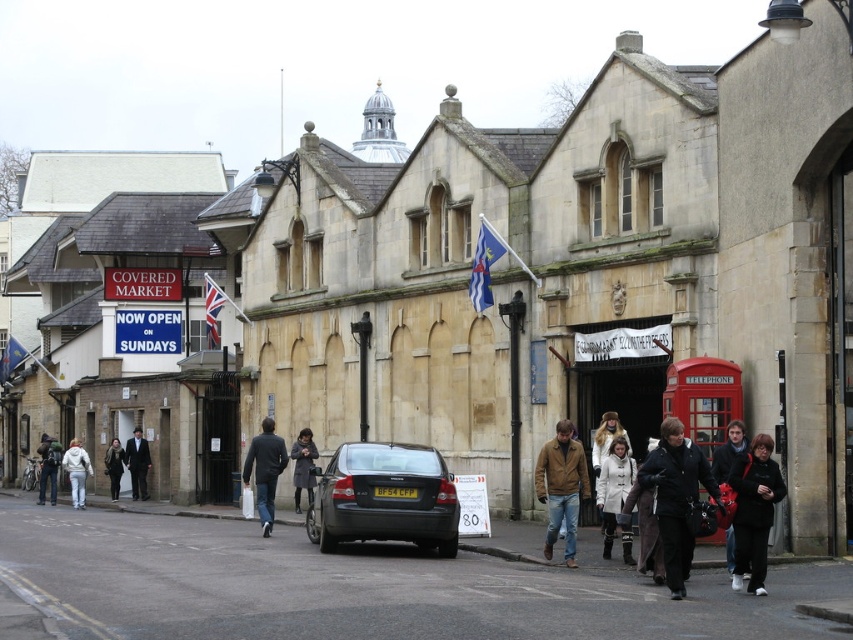
Question: Considering the relative positions of white wool coat at center and white fleece jacket at center in the image provided, where is white wool coat at center located with respect to white fleece jacket at center?

Choices:
 (A) above
 (B) below

Answer: (A)

Question: Does black fabric jacket at lower right appear under dark brown leather coat at center?

Choices:
 (A) no
 (B) yes

Answer: (A)

Question: Which of the following is the farthest from the observer?

Choices:
 (A) (728, 422)
 (B) (424, 541)
 (C) (129, 448)
 (D) (74, 445)

Answer: (C)

Question: Estimate the real-world distances between objects in this image. Which object is closer to the dark brown leather jacket at lower left?

Choices:
 (A) white fleece jacket at center
 (B) dark brown leather coat at center
 (C) dark blue jacket at center
 (D) brown leather jacket at center

Answer: (A)

Question: Which point is closer to the camera taking this photo?

Choices:
 (A) (115, 477)
 (B) (631, 464)
 (C) (679, 433)

Answer: (C)

Question: Considering the relative positions of dark gray metallic sedan at center and white wool coat at center in the image provided, where is dark gray metallic sedan at center located with respect to white wool coat at center?

Choices:
 (A) left
 (B) right

Answer: (A)